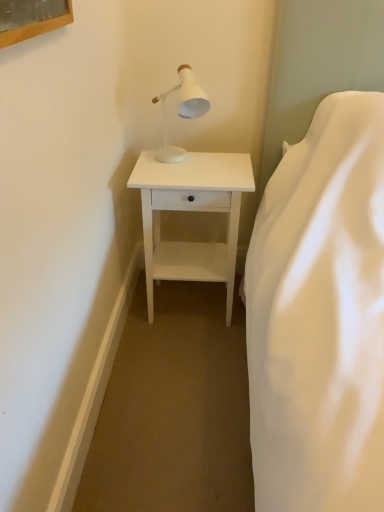
Find the location of `free space in front of white matte table lamp at upper center`. free space in front of white matte table lamp at upper center is located at coordinates (183, 178).